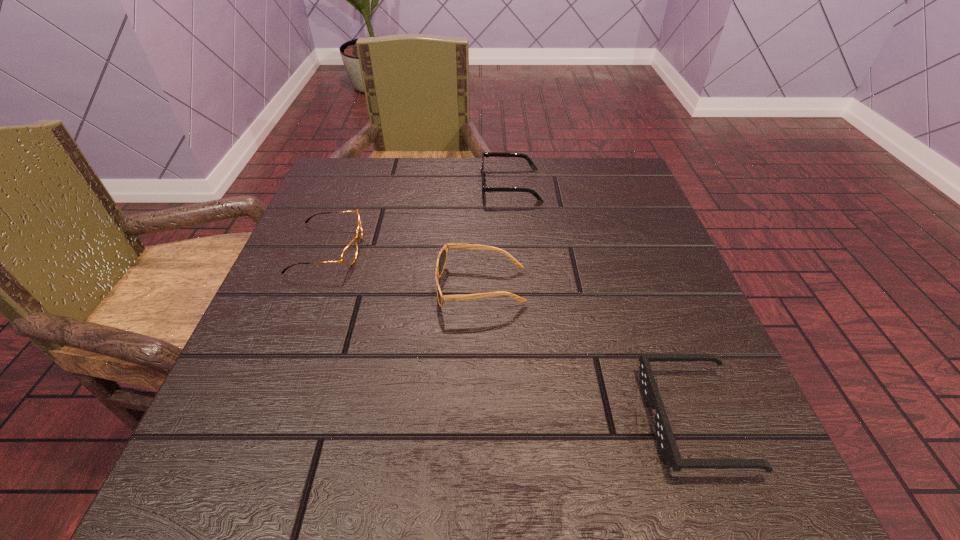
Identify the location of free spot between the shortest object and the second farthest sunglasses. (588, 353).

Identify the location of unoccupied area between the spectacles and the farthest sunglasses. Image resolution: width=960 pixels, height=540 pixels. (420, 217).

Locate an element on the screen. free space between the second farthest sunglasses and the leftmost object is located at coordinates (404, 268).

The width and height of the screenshot is (960, 540). Identify the location of free area in between the farthest object and the second farthest sunglasses. (495, 236).

I want to click on empty space between the second nearest sunglasses and the rightmost sunglasses, so click(588, 353).

This screenshot has width=960, height=540. In order to click on free space between the nearest object and the second nearest sunglasses in this screenshot , I will do pos(588,353).

Locate an element on the screen. This screenshot has width=960, height=540. object that is the closest one to the leftmost object is located at coordinates (442, 257).

You are a GUI agent. You are given a task and a screenshot of the screen. Output one action in this format:
    pyautogui.click(x=<x>, y=<y>)
    Task: Click on the object that is the closest to the nearest object
    The height and width of the screenshot is (540, 960).
    Given the screenshot: What is the action you would take?
    pyautogui.click(x=442, y=257)

Select which sunglasses is the third closest to the spectacles. Please provide its 2D coordinates. Your answer should be formatted as a tuple, i.e. [(x, y)], where the tuple contains the x and y coordinates of a point satisfying the conditions above.

[(665, 439)]

The width and height of the screenshot is (960, 540). I want to click on sunglasses that is the closest to the farthest sunglasses, so click(x=442, y=257).